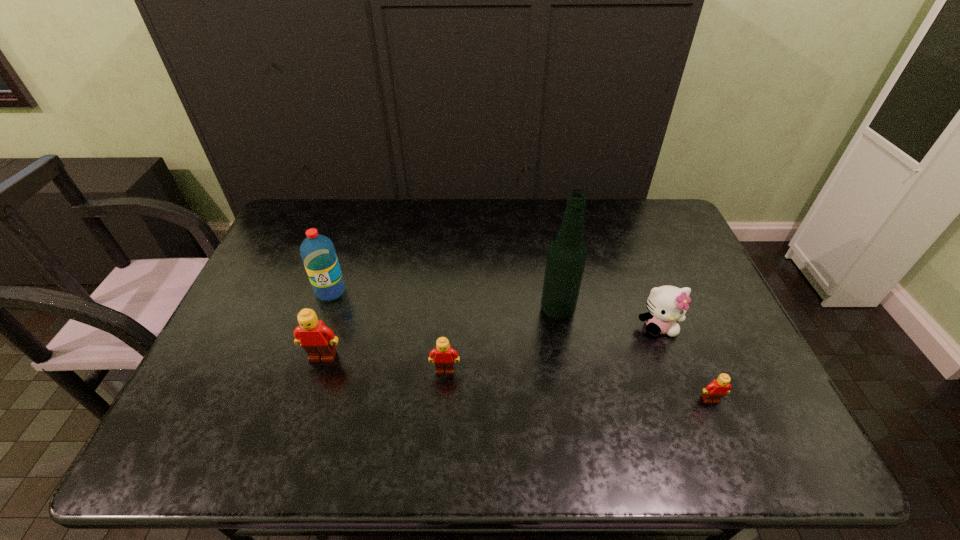
Please determine a free point for an extra Lego to ensure balance. Please provide its 2D coordinates. Your answer should be formatted as a tuple, i.e. [(x, y)], where the tuple contains the x and y coordinates of a point satisfying the conditions above.

[(574, 385)]